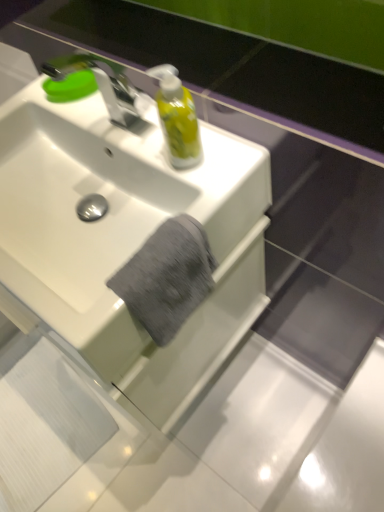
Question: Considering the relative sizes of gray cotton towel at center and silver metallic faucet at upper left in the image provided, is gray cotton towel at center thinner than silver metallic faucet at upper left?

Choices:
 (A) yes
 (B) no

Answer: (B)

Question: Is gray cotton towel at center positioned with its back to silver metallic faucet at upper left?

Choices:
 (A) no
 (B) yes

Answer: (B)

Question: Considering the relative sizes of gray cotton towel at center and silver metallic faucet at upper left in the image provided, is gray cotton towel at center taller than silver metallic faucet at upper left?

Choices:
 (A) yes
 (B) no

Answer: (B)

Question: Can we say gray cotton towel at center lies outside silver metallic faucet at upper left?

Choices:
 (A) yes
 (B) no

Answer: (A)

Question: From the image's perspective, would you say gray cotton towel at center is positioned over silver metallic faucet at upper left?

Choices:
 (A) yes
 (B) no

Answer: (B)

Question: From the image's perspective, would you say gray cotton towel at center is shown under silver metallic faucet at upper left?

Choices:
 (A) no
 (B) yes

Answer: (B)

Question: From a real-world perspective, is silver metallic faucet at upper left located beneath green matte soap at upper left?

Choices:
 (A) yes
 (B) no

Answer: (B)

Question: Does silver metallic faucet at upper left have a smaller size compared to green matte soap at upper left?

Choices:
 (A) no
 (B) yes

Answer: (A)

Question: From the image's perspective, would you say silver metallic faucet at upper left is shown under green matte soap at upper left?

Choices:
 (A) no
 (B) yes

Answer: (B)

Question: From the image's perspective, is silver metallic faucet at upper left located above green matte soap at upper left?

Choices:
 (A) yes
 (B) no

Answer: (B)

Question: Can you confirm if silver metallic faucet at upper left is wider than green matte soap at upper left?

Choices:
 (A) no
 (B) yes

Answer: (B)

Question: From a real-world perspective, is silver metallic faucet at upper left on green matte soap at upper left?

Choices:
 (A) no
 (B) yes

Answer: (B)

Question: Does white glossy sink at center touch translucent yellow liquid at upper center?

Choices:
 (A) yes
 (B) no

Answer: (B)